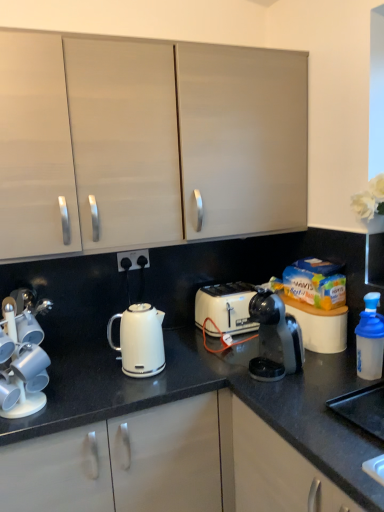
This screenshot has width=384, height=512. I want to click on blank space situated above black granite countertop at center (from a real-world perspective), so click(142, 376).